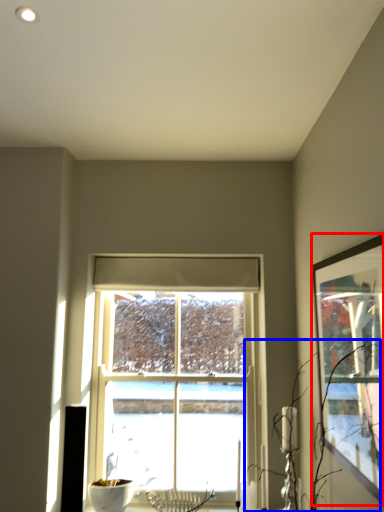
Question: Among these objects, which one is farthest to the camera, picture frame (highlighted by a red box) or branch (highlighted by a blue box)?

Choices:
 (A) picture frame
 (B) branch

Answer: (B)